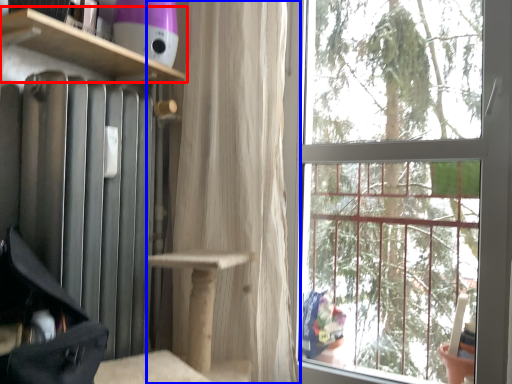
Question: Which object is closer to the camera taking this photo, shelf (highlighted by a red box) or curtain (highlighted by a blue box)?

Choices:
 (A) shelf
 (B) curtain

Answer: (A)